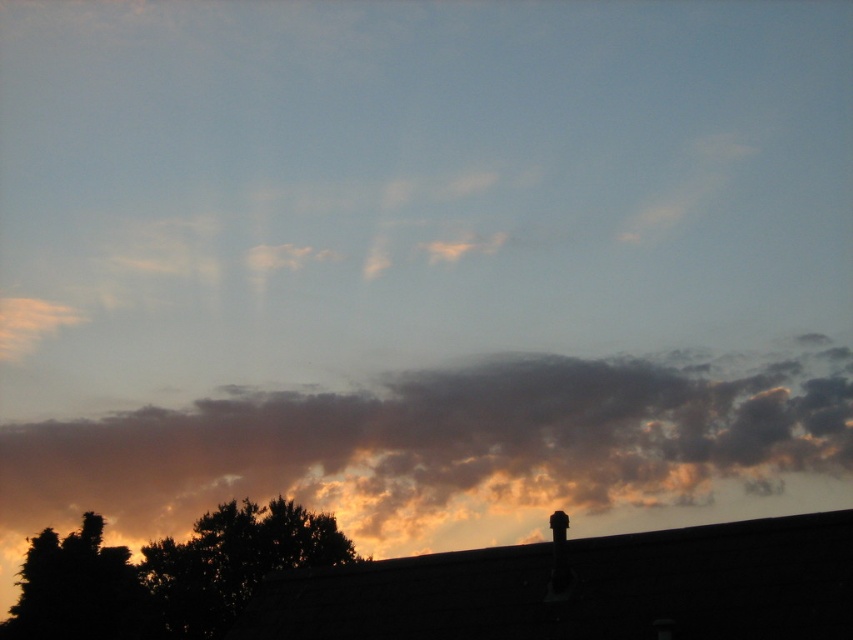
This screenshot has height=640, width=853. I want to click on orange-hued cotton cloud at center, so click(461, 449).

Can you confirm if orange-hued cotton cloud at center is smaller than dark green leafy tree at lower left?

Incorrect, orange-hued cotton cloud at center is not smaller in size than dark green leafy tree at lower left.

Describe the element at coordinates (461, 449) in the screenshot. Image resolution: width=853 pixels, height=640 pixels. I see `orange-hued cotton cloud at center` at that location.

Where is `orange-hued cotton cloud at center`? orange-hued cotton cloud at center is located at coordinates (461, 449).

Between point (142, 609) and point (126, 611), which one is positioned behind?

Positioned behind is point (142, 609).

Find the location of a particular element. The image size is (853, 640). silhouette leafy tree at lower left is located at coordinates (230, 564).

Is point (30, 520) closer to camera compared to point (328, 529)?

That is False.

The height and width of the screenshot is (640, 853). What do you see at coordinates (461, 449) in the screenshot? I see `orange-hued cotton cloud at center` at bounding box center [461, 449].

Which is in front, point (816, 413) or point (209, 572)?

Point (209, 572)

Identify the location of orange-hued cotton cloud at center. (461, 449).